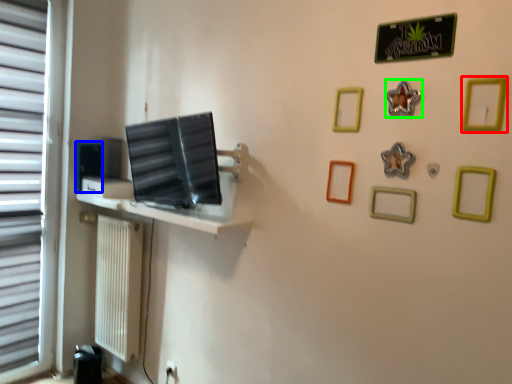
Question: Considering the real-world distances, which object is closest to picture frame (highlighted by a red box)? picture frame (highlighted by a blue box) or picture frame (highlighted by a green box).

Choices:
 (A) picture frame
 (B) picture frame

Answer: (B)